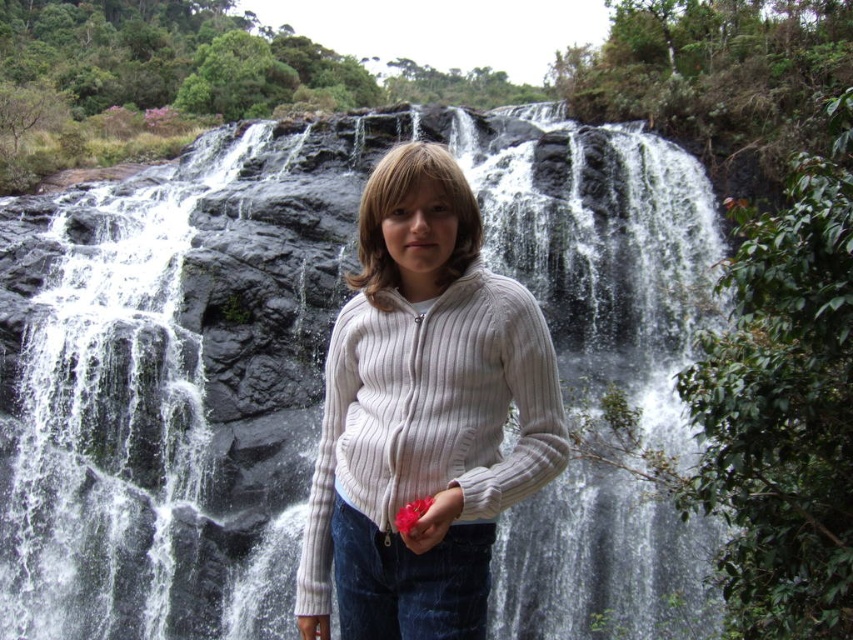
Consider the image. You are a photographer trying to capture the scene with the person and the waterfall. You notice two points in the image at coordinates point (178, 472) and point (300, 625). Which point is closer to your camera lens?

Point (178, 472) is further to the viewer than point (300, 625), so the point closer to the camera lens is point (300, 625).

You are a fashion designer observing the person in the image. You need to determine if the white ribbed sweater at center can be worn with a glove that fits the matte white hand at center. Based on the size relationship between the two items, can the glove fit the sweater?

The white ribbed sweater at center is bigger than the matte white hand at center, so the glove designed for the matte white hand at center can fit under the sweater.

You are a photographer trying to capture the person in the scene. Since you want to focus on the white ribbed sweater at center and the matte pink flower at center, which object should you adjust your camera focus on first to ensure both are in sharp detail?

The white ribbed sweater at center is closer to the viewer than the matte pink flower at center. To ensure both are in sharp detail, focus on the white ribbed sweater at center first as it is closer, and the flower will naturally fall into focus if within the depth of field.